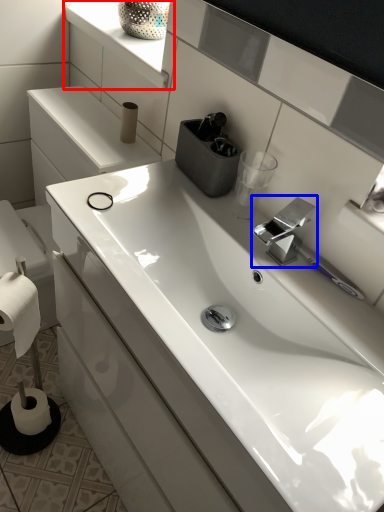
Question: Among these objects, which one is farthest to the camera, window sill (highlighted by a red box) or tap (highlighted by a blue box)?

Choices:
 (A) window sill
 (B) tap

Answer: (A)